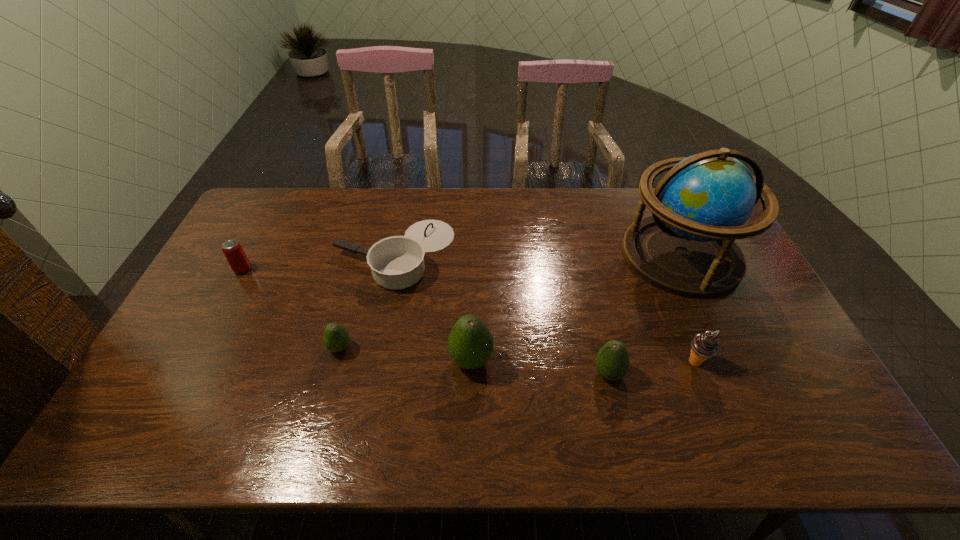
In order to click on the leftmost avocado in this screenshot , I will do (x=336, y=338).

Where is `the tallest avocado`? The image size is (960, 540). the tallest avocado is located at coordinates pos(470,343).

Where is `the second tallest object`? This screenshot has width=960, height=540. the second tallest object is located at coordinates (470, 343).

Locate an element on the screen. Image resolution: width=960 pixels, height=540 pixels. the rightmost avocado is located at coordinates (612, 362).

You are a GUI agent. You are given a task and a screenshot of the screen. Output one action in this format:
    pyautogui.click(x=<x>, y=<y>)
    Task: Click on the third object from right to left
    
    Given the screenshot: What is the action you would take?
    pyautogui.click(x=612, y=362)

Where is `the leftmost object`? The width and height of the screenshot is (960, 540). the leftmost object is located at coordinates (234, 253).

The width and height of the screenshot is (960, 540). What are the coordinates of `the tallest object` in the screenshot? It's located at (687, 247).

What are the coordinates of `icecream` in the screenshot? It's located at (704, 345).

Where is `saucepan`? saucepan is located at coordinates (397, 262).

Where is `vacant area situated 0.290m on the left of the leftmost avocado`? The width and height of the screenshot is (960, 540). vacant area situated 0.290m on the left of the leftmost avocado is located at coordinates (220, 348).